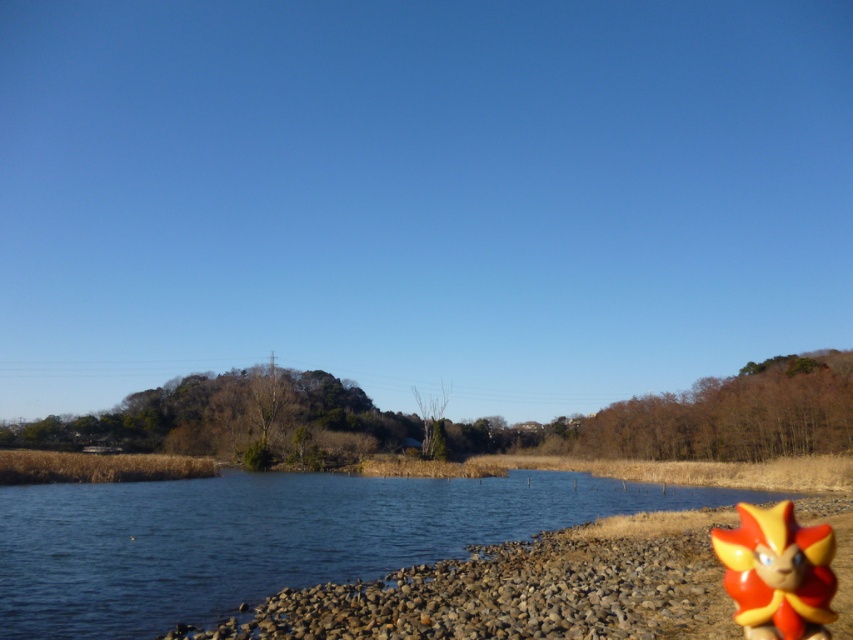
Question: Among these points, which one is farthest from the camera?

Choices:
 (A) (782, 624)
 (B) (48, 602)

Answer: (B)

Question: Considering the relative positions of blue water at lower left and shiny plastic toy at lower right in the image provided, where is blue water at lower left located with respect to shiny plastic toy at lower right?

Choices:
 (A) left
 (B) right

Answer: (A)

Question: Can you confirm if blue water at lower left is positioned to the right of shiny plastic toy at lower right?

Choices:
 (A) yes
 (B) no

Answer: (B)

Question: Which object is closer to the camera taking this photo?

Choices:
 (A) shiny plastic toy at lower right
 (B) blue water at lower left

Answer: (A)

Question: In this image, where is blue water at lower left located relative to shiny plastic toy at lower right?

Choices:
 (A) above
 (B) below

Answer: (B)

Question: Which object is farther from the camera taking this photo?

Choices:
 (A) shiny plastic toy at lower right
 (B) blue water at lower left

Answer: (B)